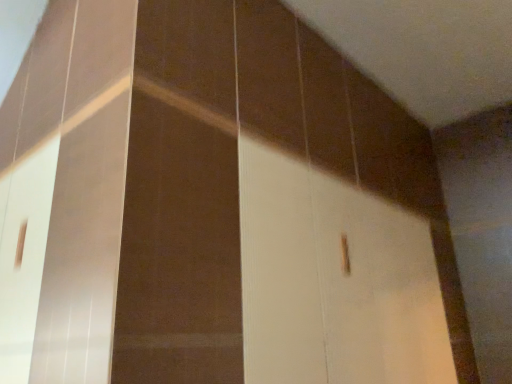
Locate an element on the screen. This screenshot has width=512, height=384. wooden at center is located at coordinates (345, 255).

What do you see at coordinates (345, 255) in the screenshot?
I see `wooden at center` at bounding box center [345, 255].

Find the location of a particular element. The image size is (512, 384). wooden at center is located at coordinates tap(345, 255).